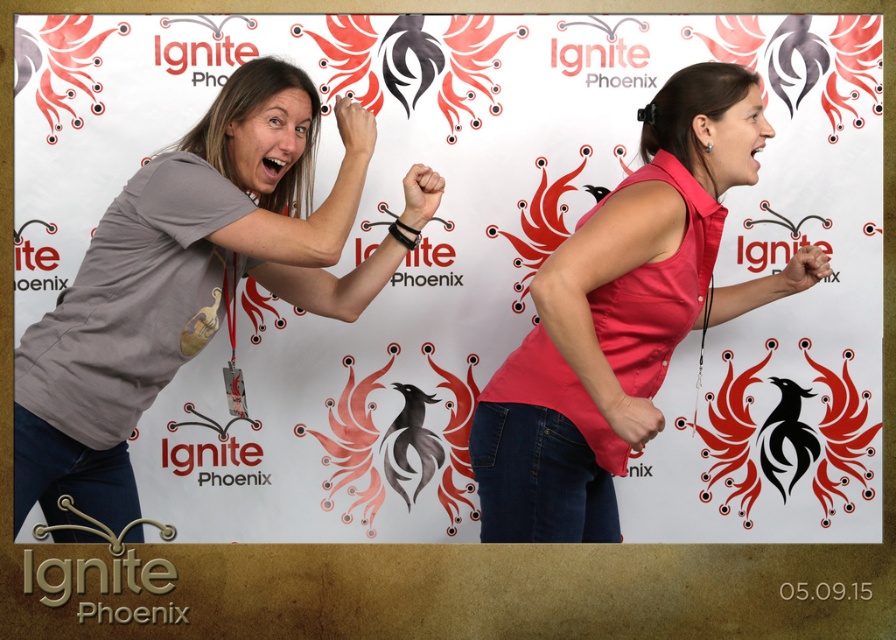
Does matte gray t-shirt at left have a larger size compared to matte pink sleeveless shirt at center?

Correct, matte gray t-shirt at left is larger in size than matte pink sleeveless shirt at center.

Which is behind, point (287, 252) or point (612, 264)?

The point (287, 252) is more distant.

The width and height of the screenshot is (896, 640). I want to click on matte gray t-shirt at left, so click(x=192, y=278).